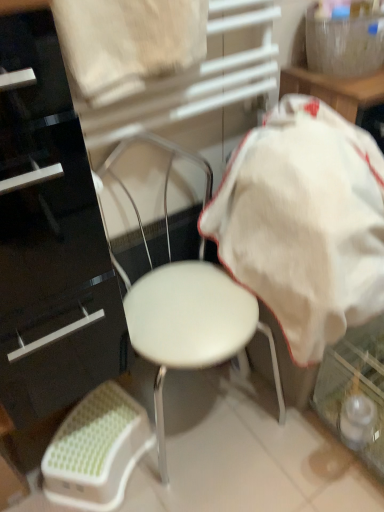
Question: Is white fabric at upper center further to the viewer compared to white matte chair at center?

Choices:
 (A) no
 (B) yes

Answer: (A)

Question: From the image's perspective, is white fabric at upper center below white matte chair at center?

Choices:
 (A) yes
 (B) no

Answer: (B)

Question: Considering the relative sizes of white fabric at upper center and white matte chair at center in the image provided, is white fabric at upper center smaller than white matte chair at center?

Choices:
 (A) no
 (B) yes

Answer: (B)

Question: Is white matte chair at center completely or partially inside white fabric at upper center?

Choices:
 (A) no
 (B) yes

Answer: (A)

Question: Could you tell me if white fabric at upper center is facing white matte chair at center?

Choices:
 (A) no
 (B) yes

Answer: (A)

Question: Is the surface of white fabric at upper center in direct contact with white matte chair at center?

Choices:
 (A) no
 (B) yes

Answer: (A)

Question: Is white matte chair at center not inside white cotton blanket at center?

Choices:
 (A) no
 (B) yes

Answer: (B)

Question: Can you confirm if white matte chair at center is positioned to the right of white cotton blanket at center?

Choices:
 (A) yes
 (B) no

Answer: (B)

Question: Does white matte chair at center have a greater width compared to white cotton blanket at center?

Choices:
 (A) no
 (B) yes

Answer: (A)

Question: Can you confirm if white matte chair at center is shorter than white cotton blanket at center?

Choices:
 (A) no
 (B) yes

Answer: (A)

Question: Does white matte chair at center have a smaller size compared to white cotton blanket at center?

Choices:
 (A) yes
 (B) no

Answer: (B)

Question: Can you confirm if white matte chair at center is positioned to the left of white cotton blanket at center?

Choices:
 (A) yes
 (B) no

Answer: (A)

Question: Is white plastic bar stool at lower left to the left of white fabric at upper center from the viewer's perspective?

Choices:
 (A) no
 (B) yes

Answer: (B)